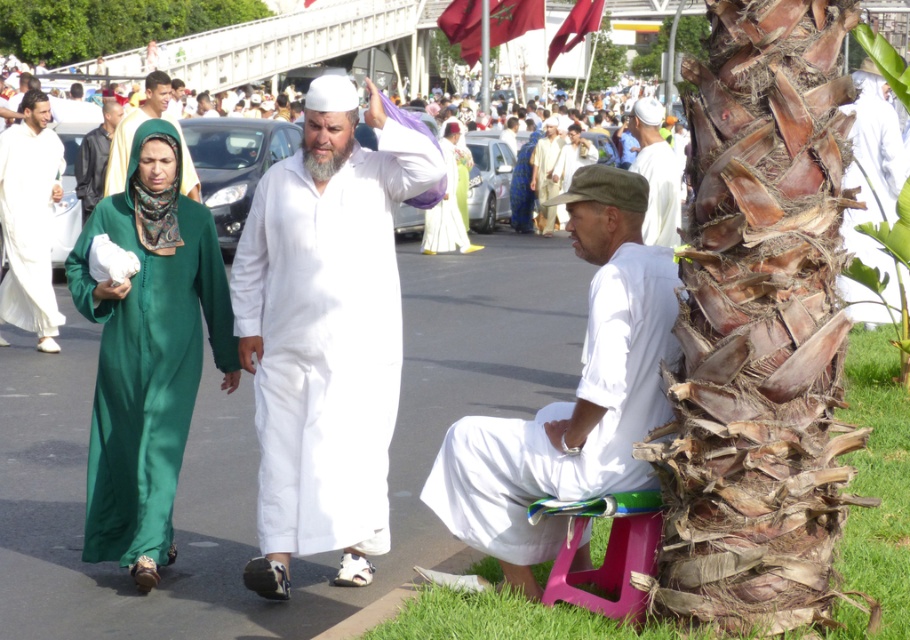
Which is below, white matte clothing at center or white cotton shirt at lower right?

Positioned lower is white cotton shirt at lower right.

What do you see at coordinates (325, 333) in the screenshot?
I see `white matte clothing at center` at bounding box center [325, 333].

This screenshot has width=910, height=640. Identify the location of white matte clothing at center. (325, 333).

Can you confirm if white matte robe at left is thinner than white cotton robe at center?

Yes.

Is white matte robe at left positioned behind white cotton robe at center?

No, white matte robe at left is in front of white cotton robe at center.

This screenshot has height=640, width=910. In order to click on white matte robe at left in this screenshot , I will do `click(29, 220)`.

Is blue satin dress at center to the right of white cotton shirt at upper center from the viewer's perspective?

Yes, blue satin dress at center is to the right of white cotton shirt at upper center.

Measure the distance between blue satin dress at center and white cotton shirt at upper center.

blue satin dress at center is 9.19 meters away from white cotton shirt at upper center.

Who is more distant from viewer, (527,177) or (25,77)?

Point (527,177)

This screenshot has width=910, height=640. I want to click on blue satin dress at center, so click(523, 186).